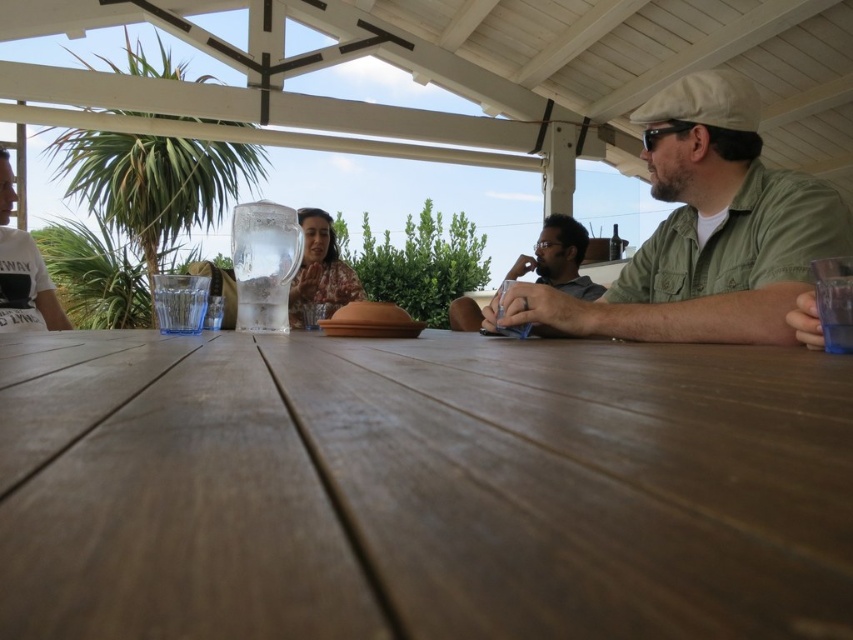
You are trying to place a rectangular object that is 1 meter long on the brown wooden table at center. Considering the matte brown shirt at center is currently occupying part of the table, can the object fit on the table without overlapping the shirt?

The brown wooden table at center is wider than the matte brown shirt at center, so the 1 meter long object can fit on the table without overlapping the shirt as long as it is placed along the table width where the shirt is not occupying the entire space.

You are standing at the entrance of the patio and want to join the group seated around the brown wooden table at center. Based on the coordinates provided, in which direction should you walk to reach the table?

The brown wooden table at center is located at point coordinates, so you should walk towards the center of the patio to reach it.